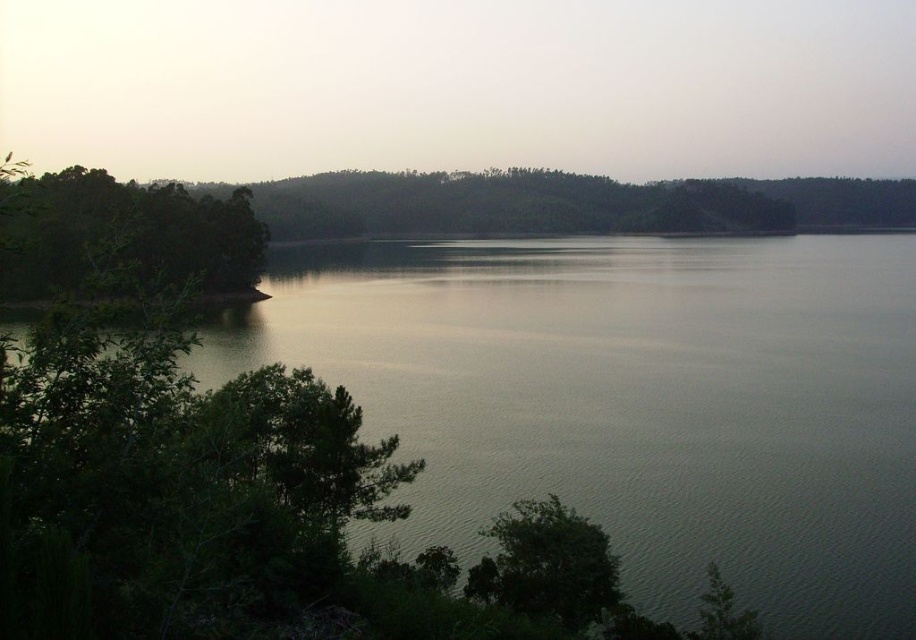
Question: Is greenish water at center wider than green leafy tree at lower left?

Choices:
 (A) yes
 (B) no

Answer: (A)

Question: Can you confirm if green leafy trees at left is bigger than green leafy tree at lower left?

Choices:
 (A) no
 (B) yes

Answer: (B)

Question: Does greenish water at center appear on the right side of green leafy trees at left?

Choices:
 (A) yes
 (B) no

Answer: (A)

Question: Which object appears closest to the camera in this image?

Choices:
 (A) greenish water at center
 (B) green leafy tree at lower left
 (C) green leafy trees at left

Answer: (C)

Question: Which of these objects is positioned closest to the green leafy tree at lower left?

Choices:
 (A) greenish water at center
 (B) green leafy trees at left

Answer: (A)

Question: Which object appears farthest from the camera in this image?

Choices:
 (A) green leafy trees at left
 (B) greenish water at center

Answer: (B)